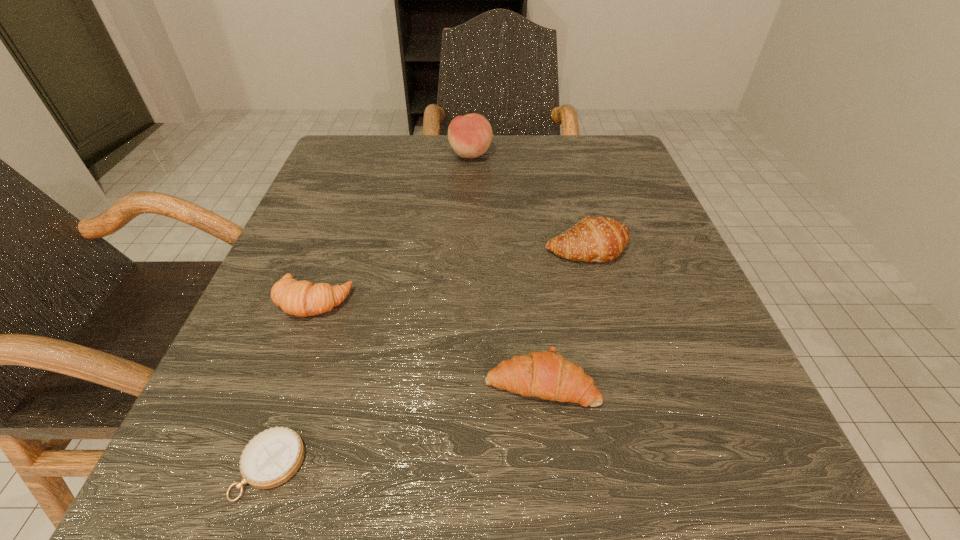
I want to click on free space located on the back of the second farthest object, so click(573, 194).

Find the location of a particular element. Image resolution: width=960 pixels, height=540 pixels. vacant position located on the back of the third farthest object is located at coordinates (352, 195).

Locate an element on the screen. vacant space located 0.290m on the left of the fourth farthest object is located at coordinates (258, 382).

Locate an element on the screen. The height and width of the screenshot is (540, 960). free region located on the back of the shortest object is located at coordinates (306, 361).

Identify the location of object that is positioned at the far edge. (470, 136).

The image size is (960, 540). What are the coordinates of `object located in the near edge section of the desktop` in the screenshot? It's located at (272, 457).

The width and height of the screenshot is (960, 540). What are the coordinates of `crescent roll at the left edge` in the screenshot? It's located at (303, 298).

In order to click on compass present at the left edge in this screenshot , I will do `click(272, 457)`.

Identify the location of object present at the right edge. The width and height of the screenshot is (960, 540). (600, 239).

Locate an element on the screen. The image size is (960, 540). object positioned at the near left corner is located at coordinates (272, 457).